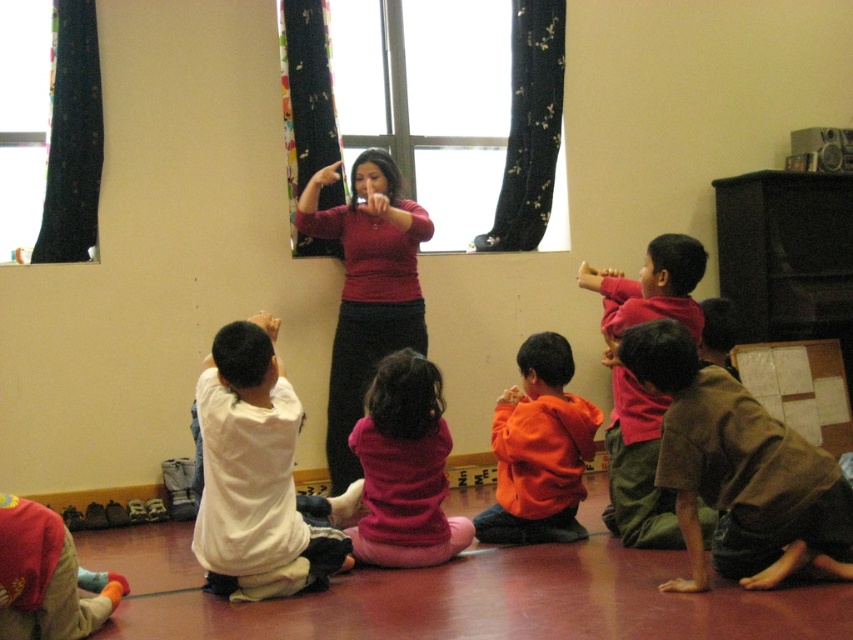
Can you confirm if black floral fabric at upper center is positioned above floral fabric curtain at upper center?

Yes, black floral fabric at upper center is above floral fabric curtain at upper center.

Is black floral fabric at upper center thinner than floral fabric curtain at upper center?

No, black floral fabric at upper center is not thinner than floral fabric curtain at upper center.

This screenshot has width=853, height=640. What are the coordinates of `black floral fabric at upper center` in the screenshot? It's located at (531, 125).

Measure the distance between brown cotton shirt at lower right and camera.

A distance of 2.84 meters exists between brown cotton shirt at lower right and camera.

At what (x,y) coordinates should I click in order to perform the action: click on brown cotton shirt at lower right. Please return your answer as a coordinate pair (x, y). Image resolution: width=853 pixels, height=640 pixels. Looking at the image, I should click on (738, 470).

Consider the image. Between orange fleece sweater at lower center and black floral fabric at upper center, which one appears on the right side from the viewer's perspective?

Positioned to the right is black floral fabric at upper center.

Does orange fleece sweater at lower center appear on the left side of black floral fabric at upper center?

Correct, you'll find orange fleece sweater at lower center to the left of black floral fabric at upper center.

You are a GUI agent. You are given a task and a screenshot of the screen. Output one action in this format:
    pyautogui.click(x=<x>, y=<y>)
    Task: Click on the orange fleece sweater at lower center
    
    Given the screenshot: What is the action you would take?
    pyautogui.click(x=538, y=449)

Image resolution: width=853 pixels, height=640 pixels. What are the coordinates of `orange fleece sweater at lower center` in the screenshot? It's located at (538, 449).